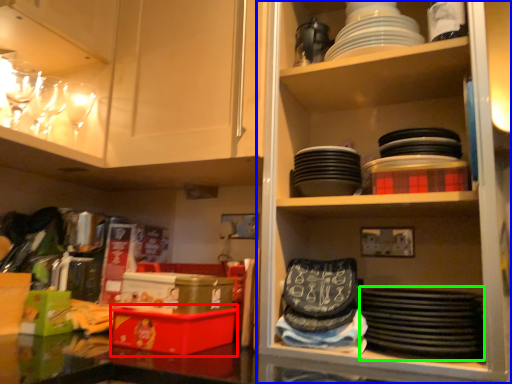
Question: Which object is positioned closest to box (highlighted by a red box)? Select from shelf (highlighted by a blue box) and platter (highlighted by a green box).

Choices:
 (A) shelf
 (B) platter

Answer: (B)